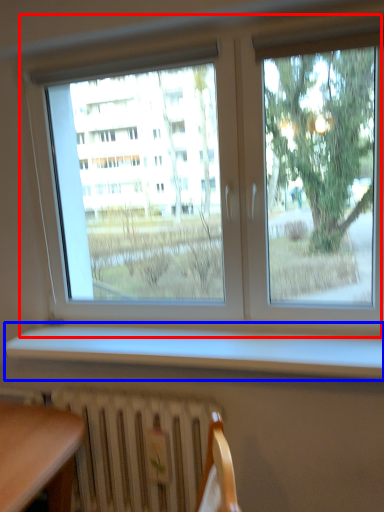
Question: Which object appears closest to the camera in this image, window (highlighted by a red box) or window sill (highlighted by a blue box)?

Choices:
 (A) window
 (B) window sill

Answer: (B)